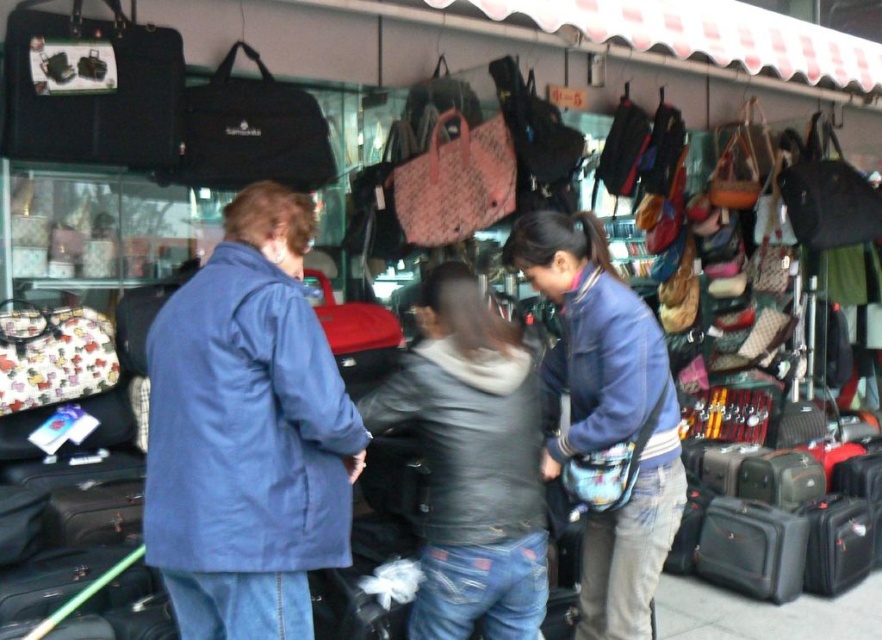
You are standing at the entrance of the market and see the point marked at coordinates (91, 90). What object is located at that point?

The point at coordinates (91, 90) marks the location of the matte black briefcase at upper left.

You are a customer at the market and want to pick up both the matte black briefcase at upper left and the floral fabric purse at center. Which item should you approach first if you are standing to the left of both objects?

You should approach the floral fabric purse at center first because the matte black briefcase at upper left is to the right of it, so the purse is closer to your left position.